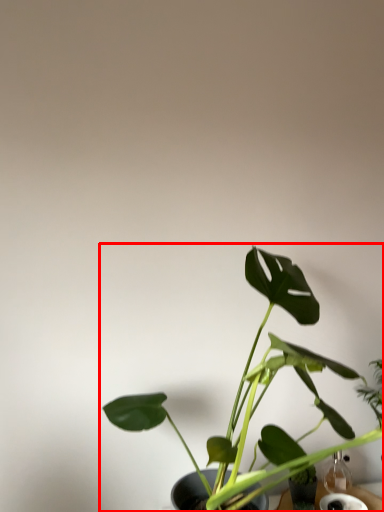
Question: From the image, what is the correct spatial relationship of houseplant (annotated by the red box) in relation to glass vase?

Choices:
 (A) left
 (B) right

Answer: (A)